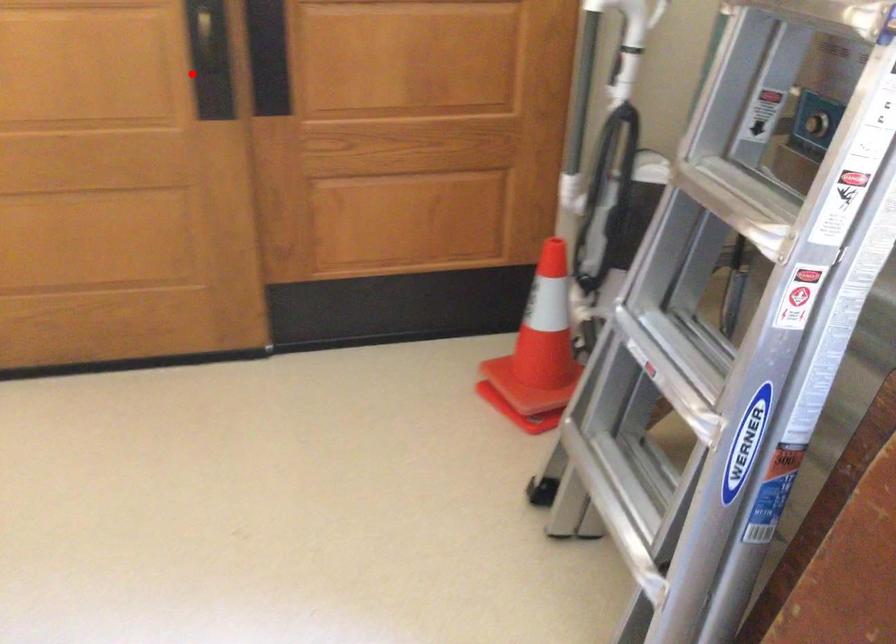
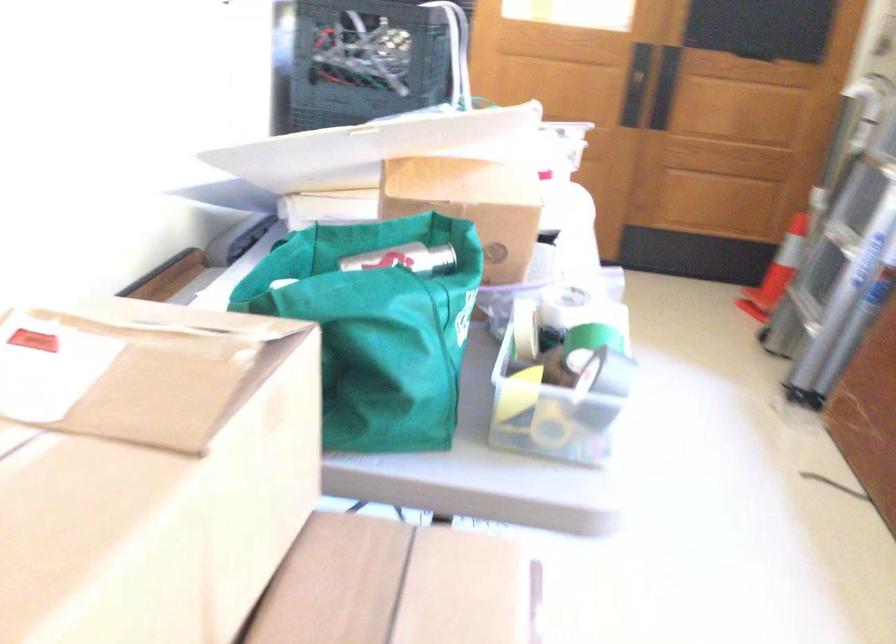
Where in the second image is the point corresponding to the highlighted location from the first image?

(639, 87)